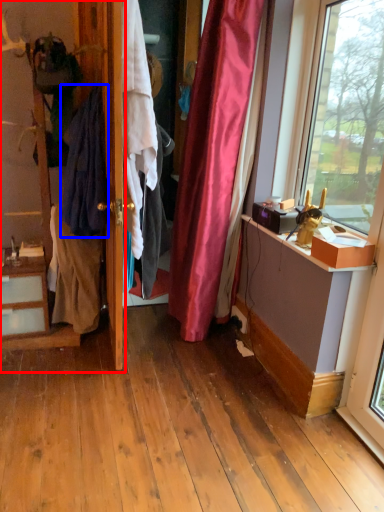
Question: Which point is closer to the camera, dresser (highlighted by a red box) or clothing (highlighted by a blue box)?

Choices:
 (A) dresser
 (B) clothing

Answer: (A)